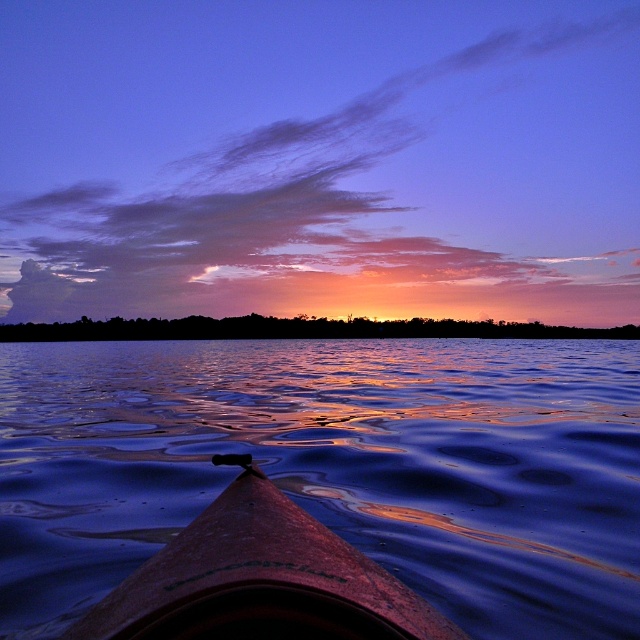
You are standing at the edge of the water and want to take a photo of the silhouetted trees at center and the glossy water at center. Since both are in the same location, which one will appear closer to you in the photo?

The glossy water at center is in front of the silhouetted trees at center, so it will appear closer to you in the photo.

You are an artist trying to paint the sunset scene. You notice two elements at the center of your canvas, the glossy water at center and the silhouetted trees at center. Which one appears narrower in your painting?

The glossy water at center is thinner than the silhouetted trees at center, so it appears narrower in the painting.

You are standing on the shore of the lake and want to take a photo of the smooth brown canoe at center and the glossy water at center. Which object will appear closer to the camera in your photo?

The glossy water at center will appear closer to the camera in the photo because the smooth brown canoe at center is positioned behind it.